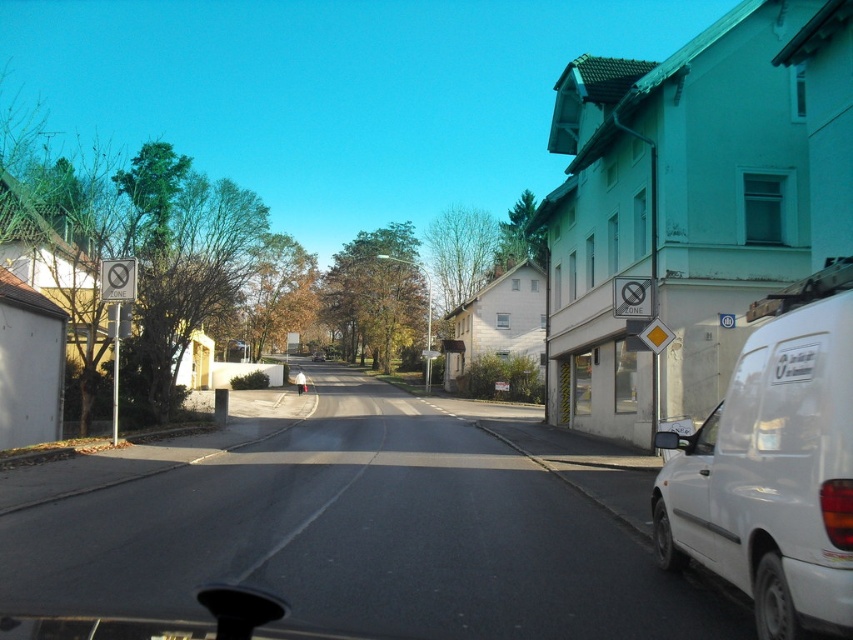
Can you confirm if white matte van at right is wider than metallic silver car at center?

Incorrect, white matte van at right's width does not surpass metallic silver car at center's.

Can you confirm if white matte van at right is positioned to the right of metallic silver car at center?

Indeed, white matte van at right is positioned on the right side of metallic silver car at center.

Which is behind, point (851, 269) or point (322, 356)?

The point (322, 356) is behind.

What are the coordinates of `white matte van at right` in the screenshot? It's located at (773, 472).